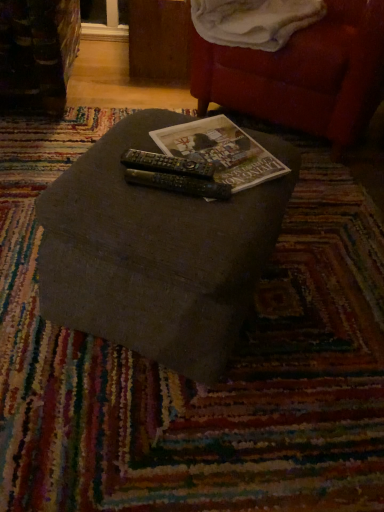
This screenshot has height=512, width=384. Find the location of `vacant space that is to the left of matte paper book at center`. vacant space that is to the left of matte paper book at center is located at coordinates (102, 166).